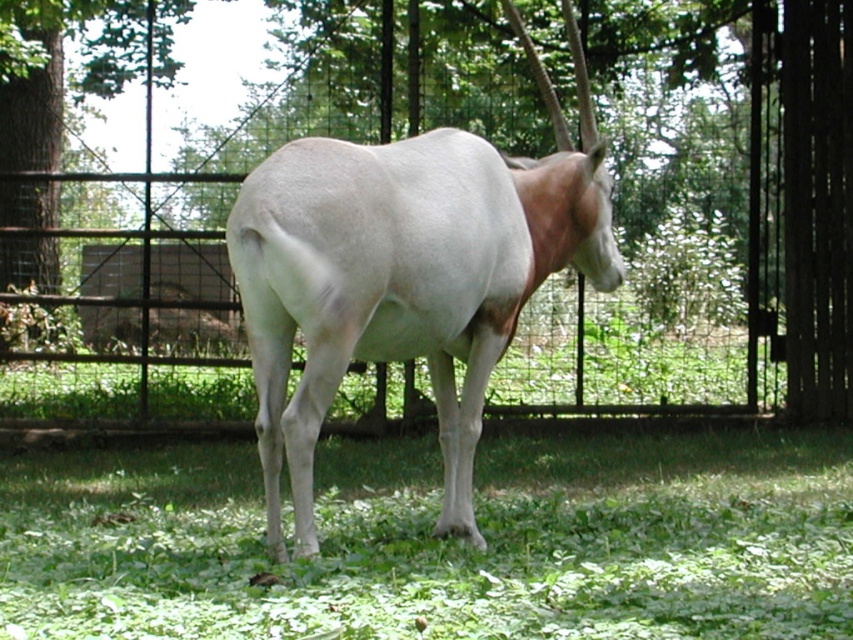
Is white smooth antelope at center closer to the viewer compared to white smooth tail at center?

No, white smooth antelope at center is further to the viewer.

Between point (273, 339) and point (265, 250), which one is positioned in front?

Point (265, 250)

Image resolution: width=853 pixels, height=640 pixels. In order to click on white smooth antelope at center in this screenshot , I will do (x=405, y=276).

Is green leafy grass at lower center smaller than green leafy tree at center?

Indeed, green leafy grass at lower center has a smaller size compared to green leafy tree at center.

Which of these two, green leafy grass at lower center or green leafy tree at center, stands taller?

green leafy tree at center is taller.

Is point (683, 604) closer to camera compared to point (115, 36)?

Yes.

Locate an element on the screen. green leafy grass at lower center is located at coordinates (440, 541).

This screenshot has width=853, height=640. Describe the element at coordinates (505, 148) in the screenshot. I see `metallic wire fence at center` at that location.

Is metallic wire fence at center above green leafy tree at center?

Actually, metallic wire fence at center is below green leafy tree at center.

This screenshot has width=853, height=640. What do you see at coordinates (505, 148) in the screenshot? I see `metallic wire fence at center` at bounding box center [505, 148].

At what (x,y) coordinates should I click in order to perform the action: click on metallic wire fence at center. Please return your answer as a coordinate pair (x, y). This screenshot has width=853, height=640. Looking at the image, I should click on (505, 148).